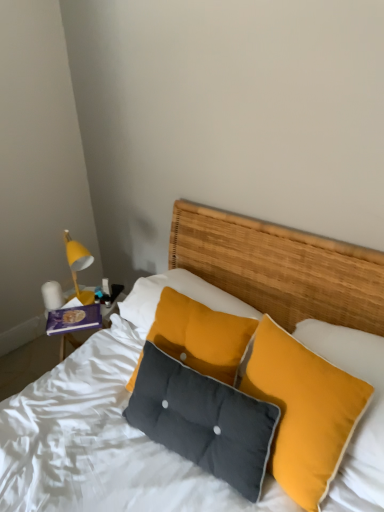
Question: Does textured yellow pillow at center, which ranks as the 2th pillow in left-to-right order, have a smaller size compared to textured woven headboard at center?

Choices:
 (A) yes
 (B) no

Answer: (A)

Question: Is textured yellow pillow at center, which ranks as the 2th pillow in left-to-right order, taller than textured woven headboard at center?

Choices:
 (A) yes
 (B) no

Answer: (B)

Question: Does textured yellow pillow at center, arranged as the first pillow when viewed from the right, lie in front of textured woven headboard at center?

Choices:
 (A) yes
 (B) no

Answer: (A)

Question: Does textured yellow pillow at center, arranged as the first pillow when viewed from the right, have a greater width compared to textured woven headboard at center?

Choices:
 (A) yes
 (B) no

Answer: (B)

Question: Is textured yellow pillow at center, arranged as the first pillow when viewed from the right, at the left side of textured woven headboard at center?

Choices:
 (A) yes
 (B) no

Answer: (B)

Question: Does textured yellow pillow at center, arranged as the first pillow when viewed from the right, have a lesser width compared to textured woven headboard at center?

Choices:
 (A) yes
 (B) no

Answer: (A)

Question: Is yellow matte lampshade at left completely or partially inside dark gray fabric pillow at center, positioned as the first pillow in left-to-right order?

Choices:
 (A) yes
 (B) no

Answer: (B)

Question: Considering the relative sizes of dark gray fabric pillow at center, positioned as the first pillow in left-to-right order, and yellow matte lampshade at left in the image provided, is dark gray fabric pillow at center, positioned as the first pillow in left-to-right order, bigger than yellow matte lampshade at left?

Choices:
 (A) no
 (B) yes

Answer: (B)

Question: Is dark gray fabric pillow at center, the second pillow when ordered from right to left, thinner than yellow matte lampshade at left?

Choices:
 (A) yes
 (B) no

Answer: (B)

Question: Is dark gray fabric pillow at center, the second pillow when ordered from right to left, taller than yellow matte lampshade at left?

Choices:
 (A) yes
 (B) no

Answer: (A)

Question: From a real-world perspective, is dark gray fabric pillow at center, positioned as the first pillow in left-to-right order, located higher than yellow matte lampshade at left?

Choices:
 (A) no
 (B) yes

Answer: (A)

Question: Is white glossy lamp at left not within dark gray fabric pillow at center, positioned as the first pillow in left-to-right order?

Choices:
 (A) no
 (B) yes

Answer: (B)